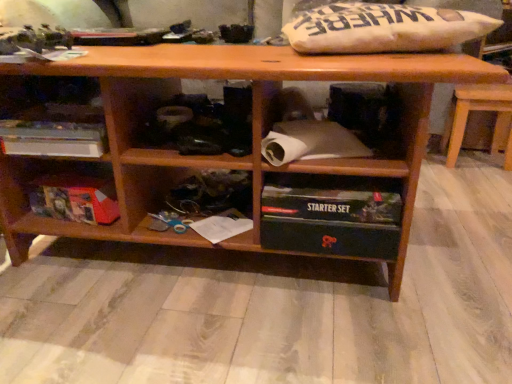
Question: From a real-world perspective, relative to brown wooden table at right, is white paper at lower center vertically above or below?

Choices:
 (A) above
 (B) below

Answer: (B)

Question: Is point (215, 233) closer or farther from the camera than point (485, 99)?

Choices:
 (A) closer
 (B) farther

Answer: (A)

Question: Based on their relative distances, which object is farther from the black plastic starter set at lower center, which ranks as the 3th shelf in left-to-right order?

Choices:
 (A) white cardboard box at left, the second shelf viewed from the left
 (B) matte cardboard box at lower left, acting as the 3th shelf starting from the right
 (C) white paper at lower center
 (D) brown wooden table at right

Answer: (D)

Question: Which object is positioned closest to the white cardboard box at left, the second shelf viewed from the left?

Choices:
 (A) matte cardboard box at lower left, acting as the 3th shelf starting from the right
 (B) black plastic starter set at lower center, which ranks as the 3th shelf in left-to-right order
 (C) brown wooden table at right
 (D) white paper at lower center

Answer: (A)